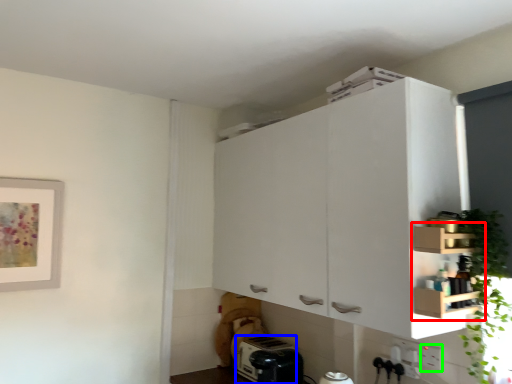
Question: Estimate the real-world distances between objects in this image. Which object is closer to cabinetry (highlighted by a red box), appliance (highlighted by a blue box) or electric outlet (highlighted by a green box)?

Choices:
 (A) appliance
 (B) electric outlet

Answer: (B)